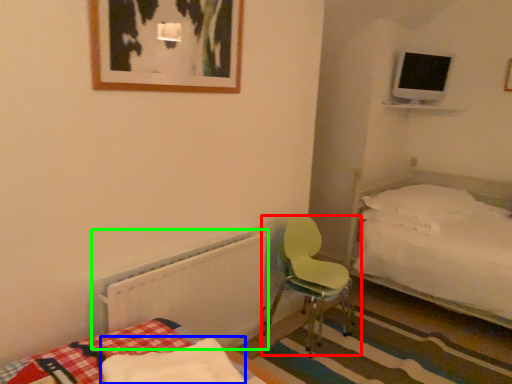
Question: Which is farther away from chair (highlighted by a red box)? mattress (highlighted by a blue box) or radiator (highlighted by a green box)?

Choices:
 (A) mattress
 (B) radiator

Answer: (A)